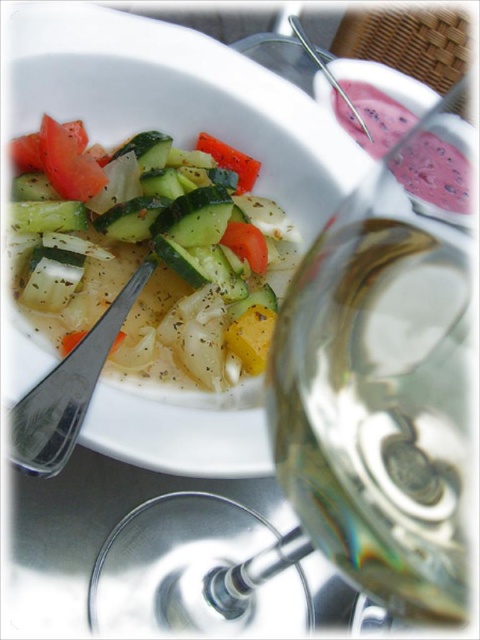
Does fresh green salad at center appear under pink smoothie at upper right?

Indeed, fresh green salad at center is positioned under pink smoothie at upper right.

Who is more forward, (50,237) or (456,177)?

Point (50,237)

Locate an element on the screen. This screenshot has height=640, width=480. fresh green salad at center is located at coordinates (157, 260).

Which is more to the right, clear glass wine glass at center or orange smooth carrot at center?

clear glass wine glass at center is more to the right.

Which is above, clear glass wine glass at center or orange smooth carrot at center?

orange smooth carrot at center is above.

Find the location of `clear glass wine glass at center`. clear glass wine glass at center is located at coordinates (367, 410).

Locate an element on the screen. The height and width of the screenshot is (640, 480). clear glass wine glass at center is located at coordinates (367, 410).

Can you confirm if fresh green salad at center is smaller than orange smooth carrot at center?

No.

Does point (248, 292) lie behind point (219, 148)?

No.

Between point (84, 332) and point (196, 145), which one is positioned behind?

The point (196, 145) is more distant.

This screenshot has height=640, width=480. What are the coordinates of `fresh green salad at center` in the screenshot? It's located at (157, 260).